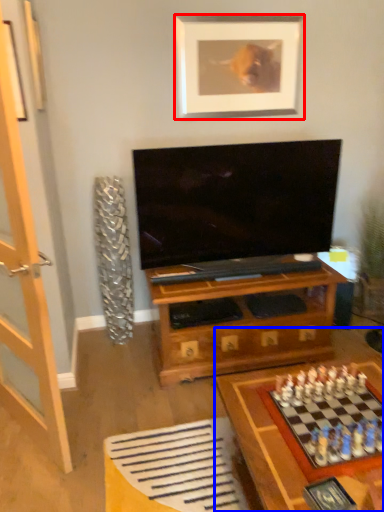
Question: Which of the following is the farthest to the observer, picture frame (highlighted by a red box) or table (highlighted by a blue box)?

Choices:
 (A) picture frame
 (B) table

Answer: (A)